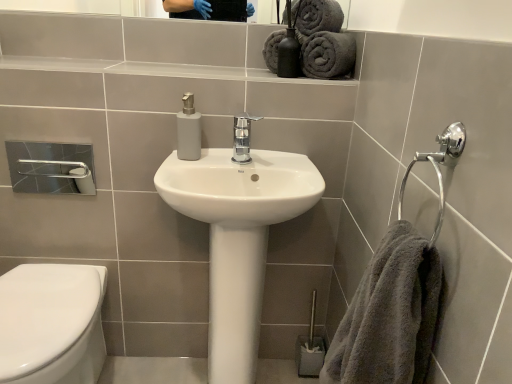
At what (x,y) coordinates should I click in order to perform the action: click on vacant space to the right of chrome metallic faucet at center. Please return your answer as a coordinate pair (x, y). The image size is (512, 384). Looking at the image, I should click on [280, 155].